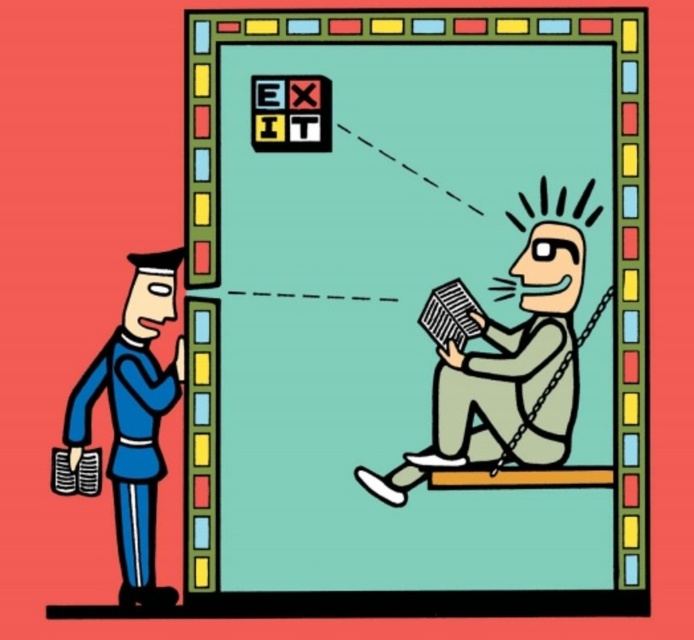
Question: Which of the following is the closest to the observer?

Choices:
 (A) (573, 346)
 (B) (108, 474)
 (C) (457, 244)

Answer: (B)

Question: From the image, what is the correct spatial relationship of matte gray book at center in relation to blue fabric uniform at left?

Choices:
 (A) above
 (B) below

Answer: (A)

Question: Among these points, which one is nearest to the camera?

Choices:
 (A) (90, 369)
 (B) (592, 12)

Answer: (A)

Question: Can you confirm if gray matte book at center is positioned above blue fabric uniform at left?

Choices:
 (A) no
 (B) yes

Answer: (B)

Question: Which point appears closest to the camera in this image?

Choices:
 (A) (480, 392)
 (B) (328, 381)

Answer: (A)

Question: Does gray matte book at center come in front of blue fabric uniform at left?

Choices:
 (A) yes
 (B) no

Answer: (A)